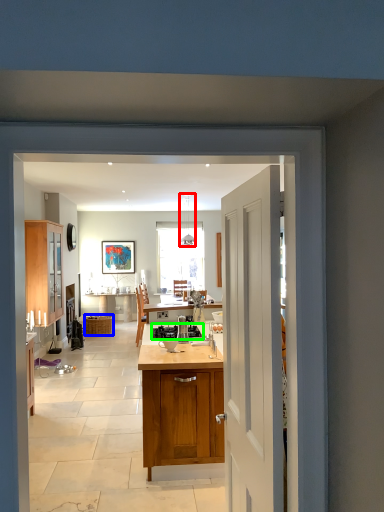
Question: Which is farther away from lamp (highlighted by a red box)? picnic basket (highlighted by a blue box) or gas stove (highlighted by a green box)?

Choices:
 (A) picnic basket
 (B) gas stove

Answer: (B)